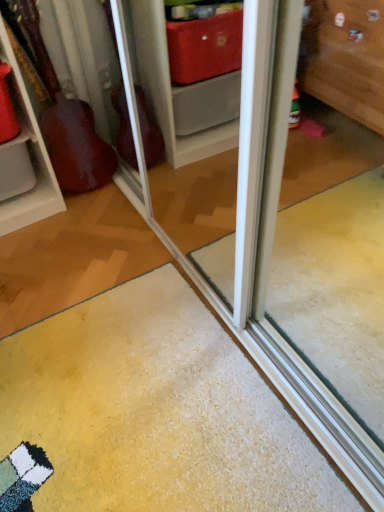
Question: From the image's perspective, is yellow carpet at lower center above or below wooden guitar at left?

Choices:
 (A) above
 (B) below

Answer: (B)

Question: Is yellow carpet at lower center inside or outside of wooden guitar at left?

Choices:
 (A) inside
 (B) outside

Answer: (B)

Question: Considering the positions of yellow carpet at lower center and wooden guitar at left in the image, is yellow carpet at lower center taller or shorter than wooden guitar at left?

Choices:
 (A) short
 (B) tall

Answer: (A)

Question: In the image, is wooden guitar at left positioned in front of or behind yellow carpet at lower center?

Choices:
 (A) front
 (B) behind

Answer: (B)

Question: Considering the positions of wooden guitar at left and yellow carpet at lower center in the image, is wooden guitar at left bigger or smaller than yellow carpet at lower center?

Choices:
 (A) small
 (B) big

Answer: (A)

Question: From the image's perspective, is wooden guitar at left positioned above or below yellow carpet at lower center?

Choices:
 (A) below
 (B) above

Answer: (B)

Question: Is wooden guitar at left taller or shorter than yellow carpet at lower center?

Choices:
 (A) short
 (B) tall

Answer: (B)